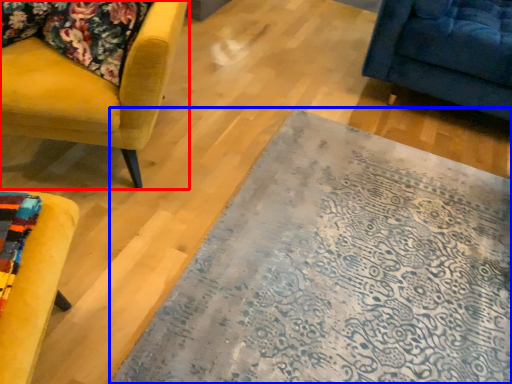
Question: Which object appears farthest to the camera in this image, chair (highlighted by a red box) or mat (highlighted by a blue box)?

Choices:
 (A) chair
 (B) mat

Answer: (A)